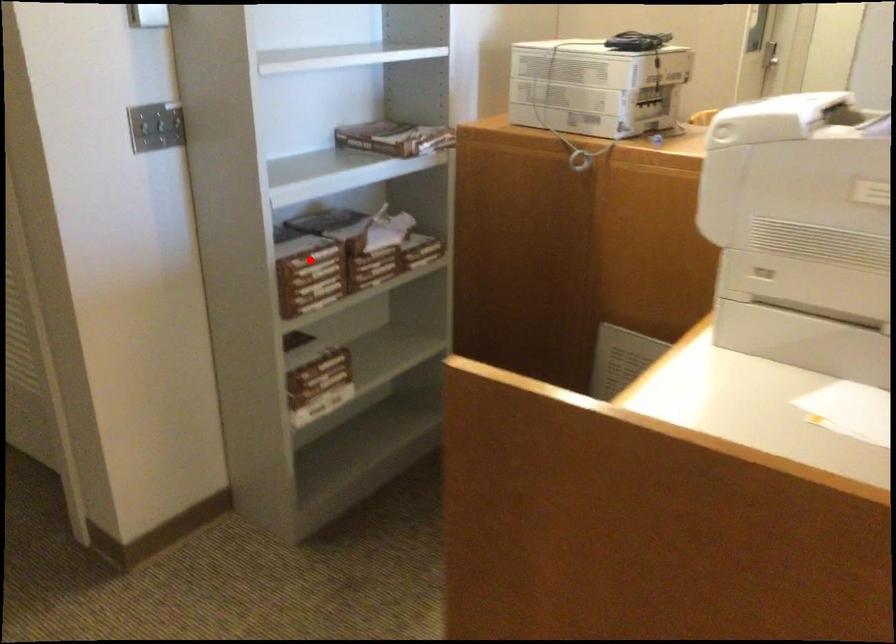
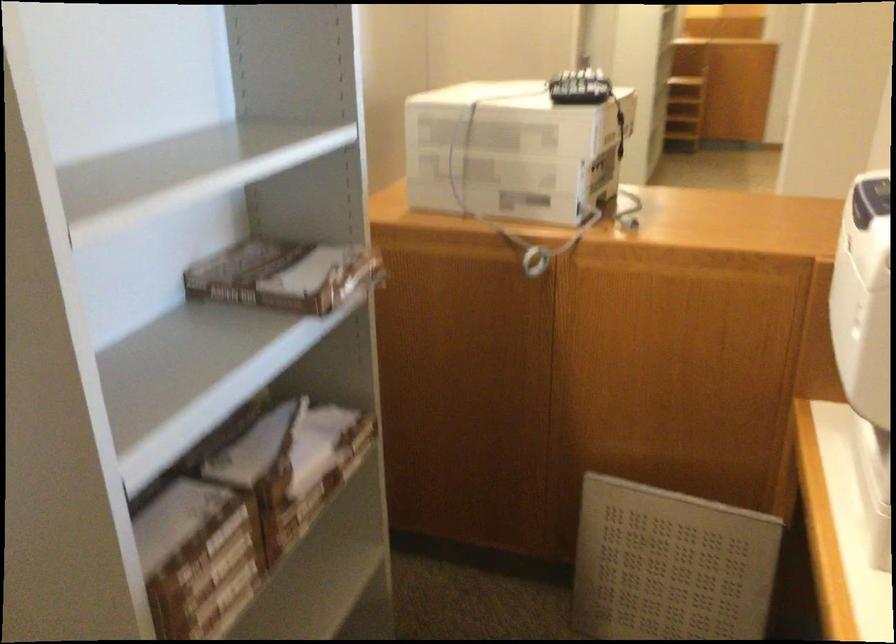
Question: I am providing you with two images of the same scene from different viewpoints. In image1, a red point is highlighted. Considering the same 3D point in image2, which of the following is correct?

Choices:
 (A) It is closer
 (B) It is farther

Answer: (A)